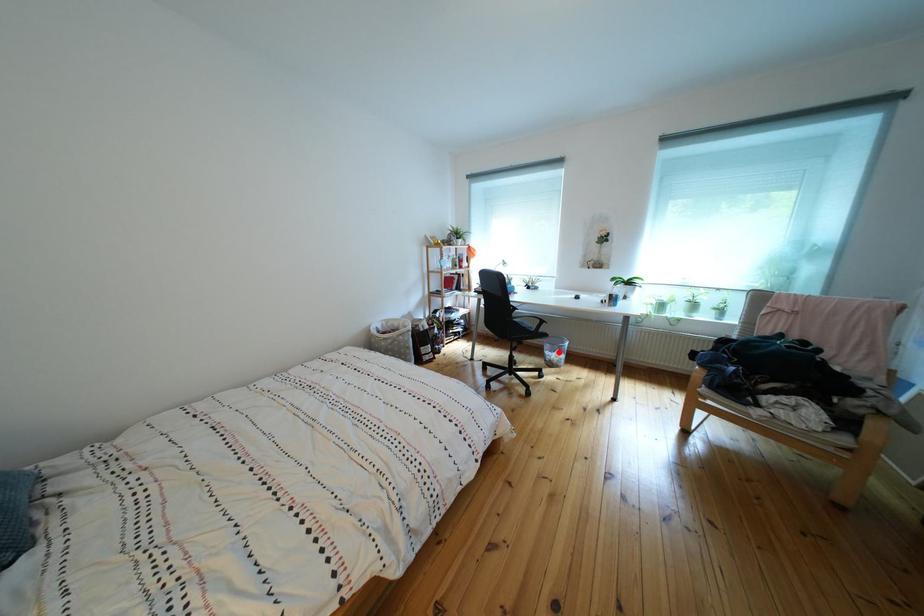
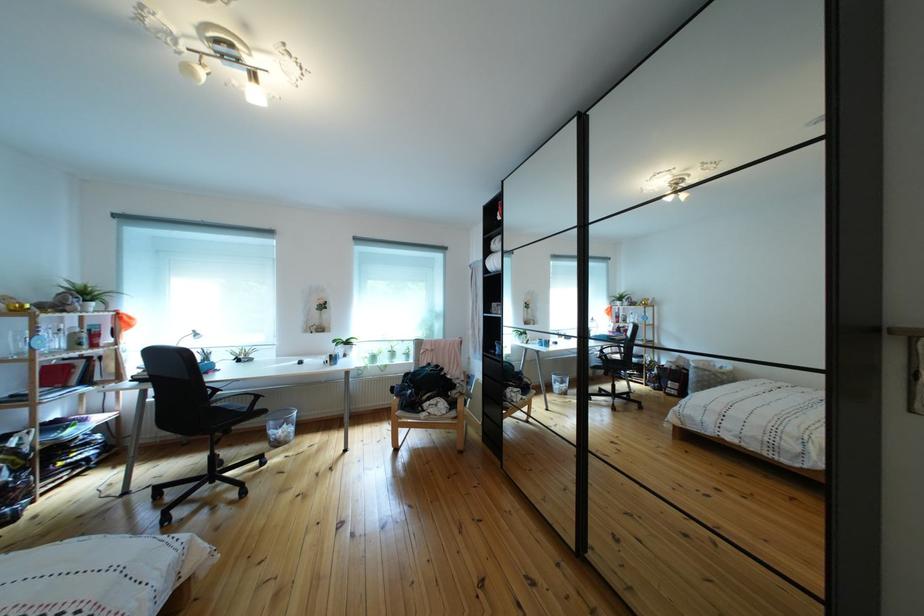
Find the pixel in the second image that matches the highlighted location in the first image.

(283, 430)